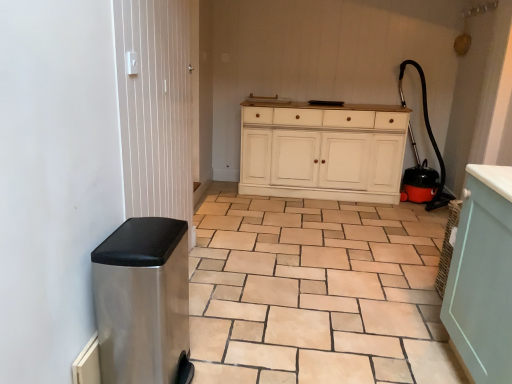
This screenshot has height=384, width=512. I want to click on free area in between white painted wood cabinet at center and metallic silver screen door at left, so click(256, 235).